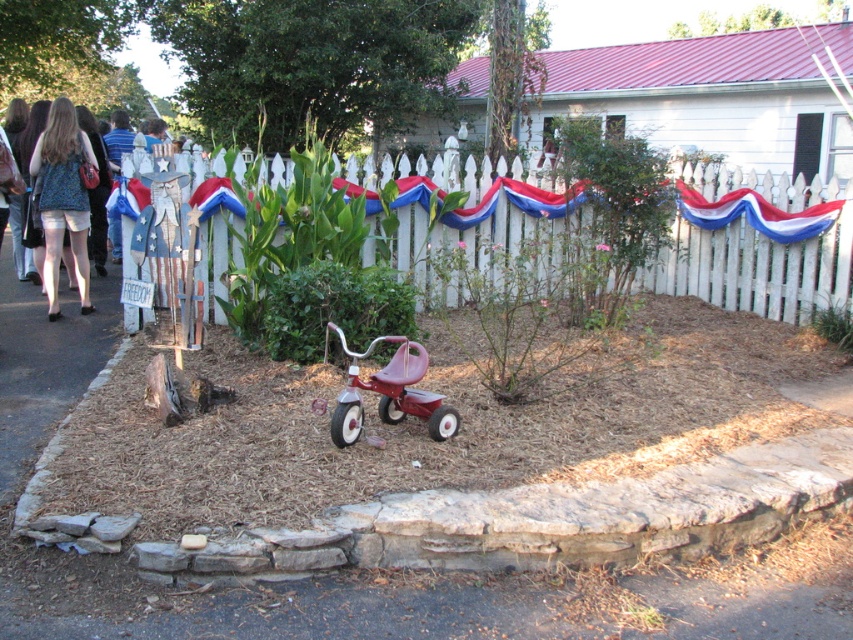
Question: Does denim shorts at left appear under metallic red tricycle at center?

Choices:
 (A) yes
 (B) no

Answer: (B)

Question: Which object appears closest to the camera in this image?

Choices:
 (A) denim shorts at left
 (B) metallic red tricycle at center

Answer: (B)

Question: Does white picket fence at center appear over metallic red tricycle at center?

Choices:
 (A) yes
 (B) no

Answer: (A)

Question: Which of the following is the farthest from the observer?

Choices:
 (A) metallic red tricycle at center
 (B) denim shorts at left

Answer: (B)

Question: Is white picket fence at center above denim shorts at left?

Choices:
 (A) no
 (B) yes

Answer: (B)

Question: Which point is farther to the camera?

Choices:
 (A) (340, 426)
 (B) (85, 288)
 (C) (422, 168)

Answer: (C)